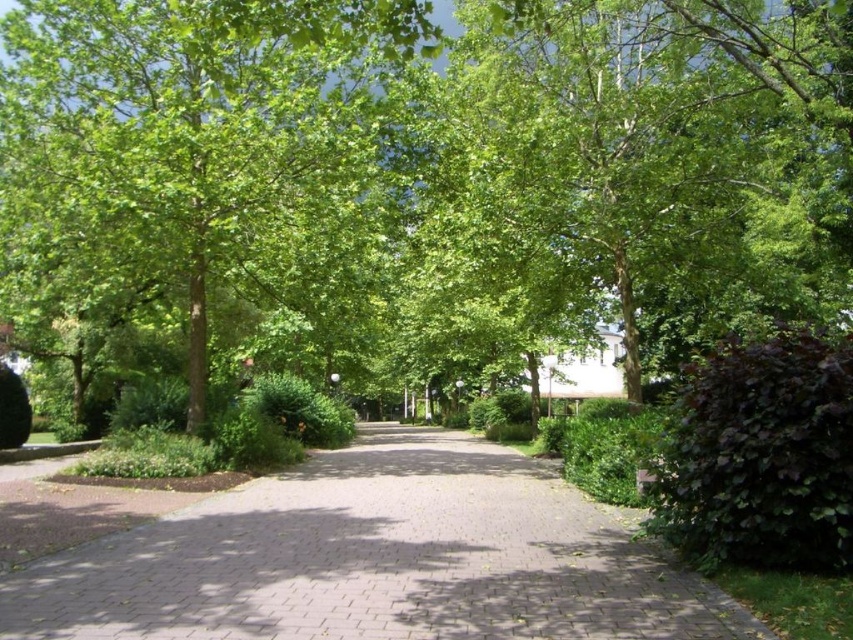
Consider the image. You are a gardener who needs to trim bushes in the park. You see the dark purple leafy bush at right and the green leafy bush at center. Which bush is shorter?

The dark purple leafy bush at right is not as tall as the green leafy bush at center, so the dark purple leafy bush at right is shorter.

You are a landscape architect designing a walking path through this park. The green leafy tree at center and the dark purple leafy bush at right are key elements. If you want to ensure the pathway remains visible, which plant should you avoid placing too close to the path to prevent blocking the view?

The green leafy tree at center has a larger width than the dark purple leafy bush at right, so you should avoid placing the green leafy tree at center too close to the path to prevent blocking the view.

You are a gardener standing at the entrance of the park and see the paved brick road at center and the green leafy tree at center. Which object is nearer to you?

The paved brick road at center is closer to the viewer than the green leafy tree at center, so the paved brick road at center is nearer to you.